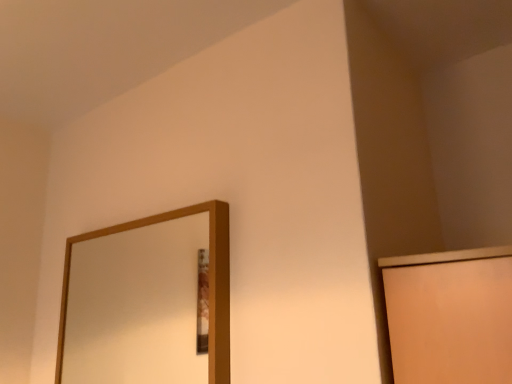
What do you see at coordinates (136, 306) in the screenshot? I see `wooden mirror at upper left` at bounding box center [136, 306].

Find the location of a particular element. Image resolution: width=512 pixels, height=384 pixels. wooden mirror at upper left is located at coordinates (136, 306).

Where is `wooden mirror at upper left`? The image size is (512, 384). wooden mirror at upper left is located at coordinates (136, 306).